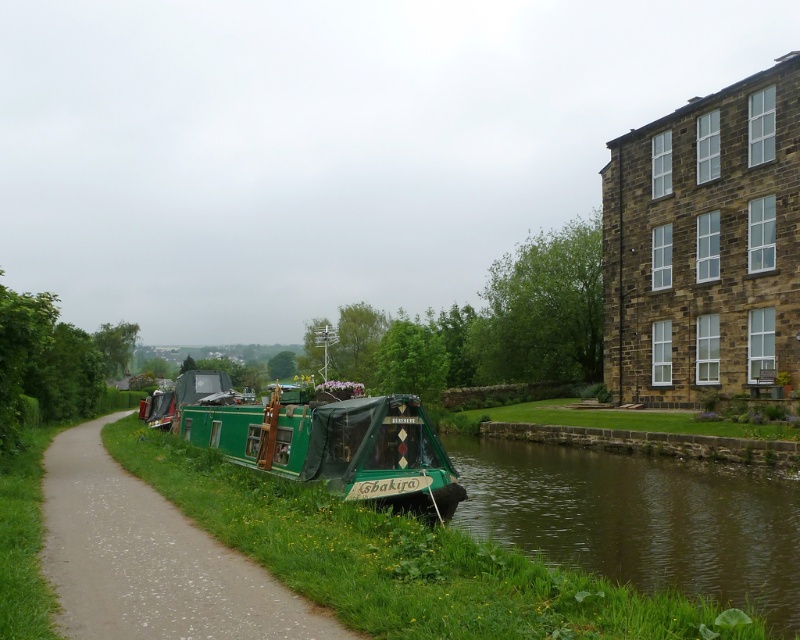
Measure the distance between green grassy river at lower right and green canvas barge at center.

→ A distance of 6.77 meters exists between green grassy river at lower right and green canvas barge at center.

What do you see at coordinates (640, 518) in the screenshot? I see `green grassy river at lower right` at bounding box center [640, 518].

Which is in front, point (784, 572) or point (430, 426)?

Positioned in front is point (784, 572).

The height and width of the screenshot is (640, 800). I want to click on green grassy river at lower right, so click(x=640, y=518).

Can you confirm if green canvas boat at center is positioned above green canvas barge at center?

No.

Who is positioned more to the right, green canvas boat at center or green canvas barge at center?

Positioned to the right is green canvas barge at center.

I want to click on green canvas boat at center, so click(150, 560).

Does green grassy river at lower right have a greater width compared to green canvas boat at center?

In fact, green grassy river at lower right might be narrower than green canvas boat at center.

Who is more distant from viewer, (504,460) or (204,557)?

Point (504,460)

The image size is (800, 640). I want to click on green grassy river at lower right, so click(640, 518).